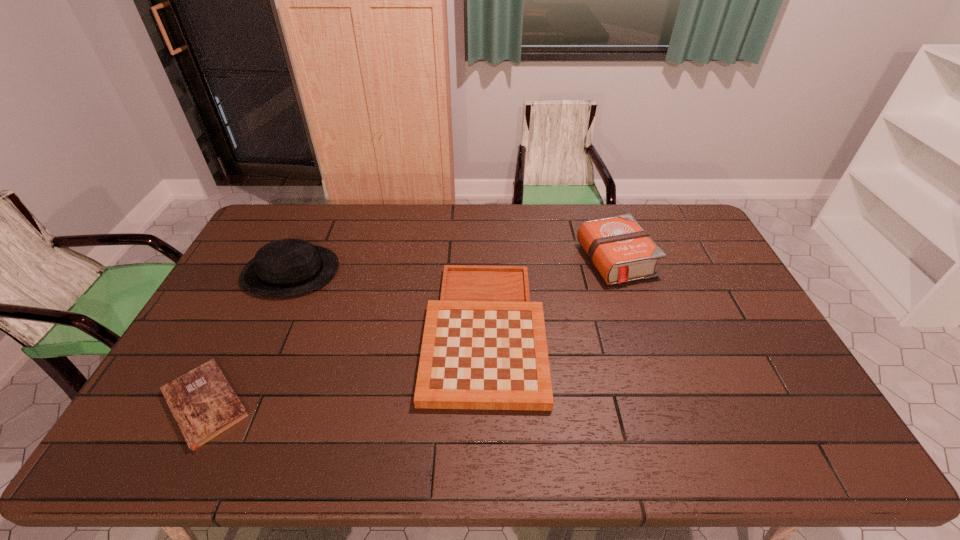
Select which object is the third closest to the fedora. Please provide its 2D coordinates. Your answer should be formatted as a tuple, i.e. [(x, y)], where the tuple contains the x and y coordinates of a point satisfying the conditions above.

[(618, 247)]

Locate an element on the screen. Image resolution: width=960 pixels, height=540 pixels. object that can be found as the third closest to the nearer Bible is located at coordinates (618, 247).

Locate an element on the screen. vacant point that satisfies the following two spatial constraints: 1. on the back side of the right Bible; 2. on the right side of the shorter Bible is located at coordinates (278, 260).

Find the location of `free space that satisfies the following two spatial constraints: 1. on the back side of the fedora; 2. on the right side of the right Bible`. free space that satisfies the following two spatial constraints: 1. on the back side of the fedora; 2. on the right side of the right Bible is located at coordinates (297, 260).

The height and width of the screenshot is (540, 960). In order to click on free space in the image that satisfies the following two spatial constraints: 1. on the back side of the nearer Bible; 2. on the left side of the fedora in this screenshot , I will do `click(272, 272)`.